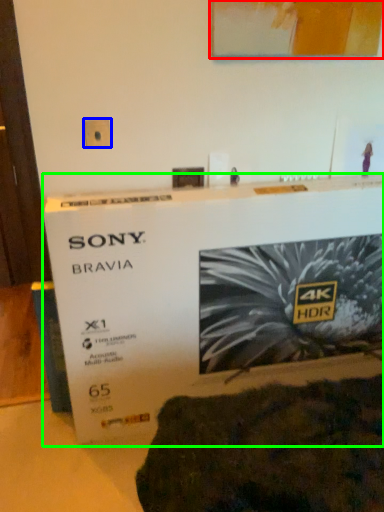
Question: Considering the real-world distances, which object is farthest from picture frame (highlighted by a red box)? electric outlet (highlighted by a blue box) or poster (highlighted by a green box)?

Choices:
 (A) electric outlet
 (B) poster

Answer: (B)